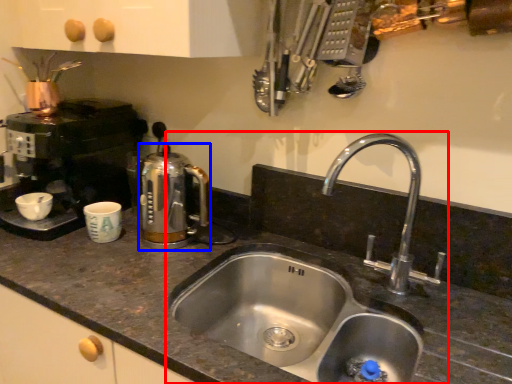
Question: Which of the following is the farthest to the observer, sink (highlighted by a red box) or coffeepot (highlighted by a blue box)?

Choices:
 (A) sink
 (B) coffeepot

Answer: (B)